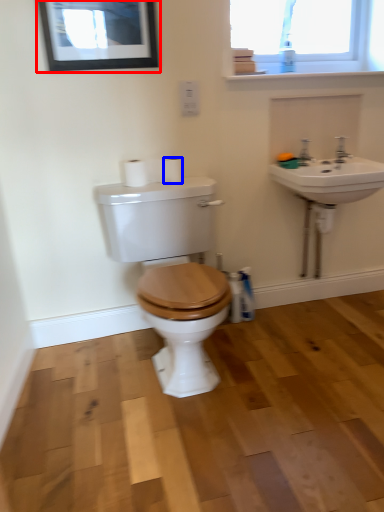
Question: Which of the following is the closest to the observer, picture frame (highlighted by a red box) or toilet paper (highlighted by a blue box)?

Choices:
 (A) picture frame
 (B) toilet paper

Answer: (A)